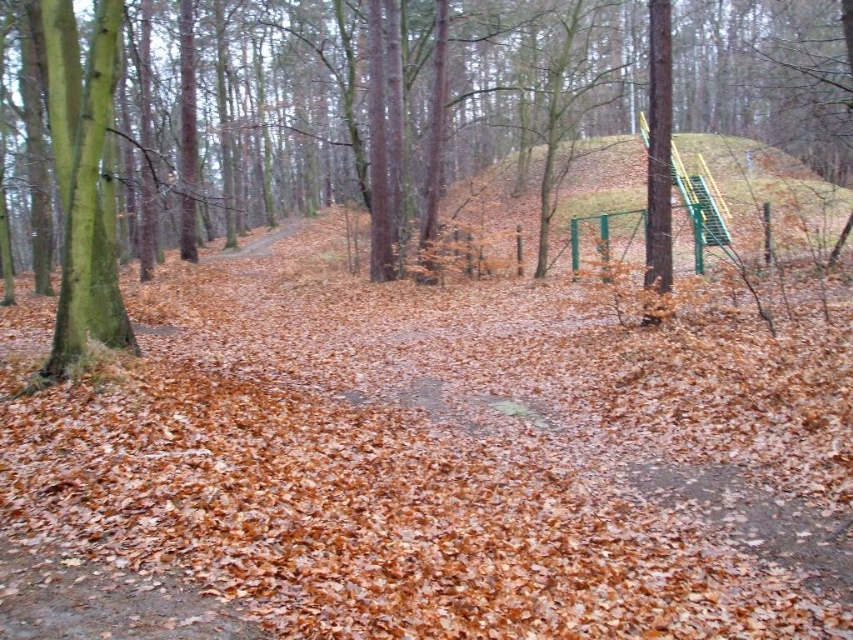
At what (x,y) coordinates should I click in order to perform the action: click on green textured tree at center. Please return your answer as a coordinate pair (x, y). This screenshot has height=640, width=853. Looking at the image, I should click on (309, 109).

From the picture: Can you confirm if green textured tree at center is taller than green rough bark tree at left?

Yes.

Which is in front, point (701, 104) or point (90, 237)?

Positioned in front is point (90, 237).

The height and width of the screenshot is (640, 853). What are the coordinates of `green textured tree at center` in the screenshot? It's located at (309, 109).

Is brown leaf litter at upper center further to camera compared to green rough bark tree at left?

No, it is not.

Between brown leaf litter at upper center and green rough bark tree at left, which one is positioned lower?

brown leaf litter at upper center is below.

Which is behind, point (155, 440) or point (70, 77)?

Point (70, 77)

Where is `brown leaf litter at upper center`? The image size is (853, 640). brown leaf litter at upper center is located at coordinates (450, 456).

Who is more distant from viewer, (466, 285) or (627, 188)?

The point (627, 188) is more distant.

At what (x,y) coordinates should I click in order to perform the action: click on brown leaf litter at upper center. Please return your answer as a coordinate pair (x, y). The width and height of the screenshot is (853, 640). Looking at the image, I should click on (450, 456).

The width and height of the screenshot is (853, 640). Find the location of `brown leaf litter at upper center`. brown leaf litter at upper center is located at coordinates (450, 456).